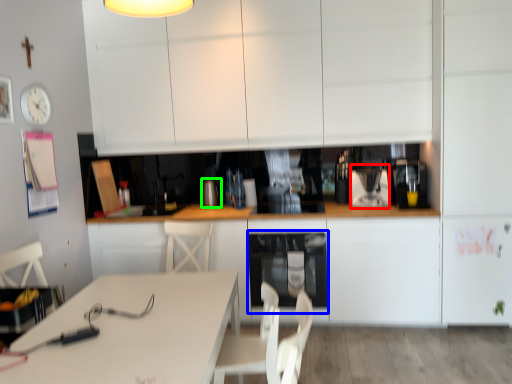
Question: Estimate the real-world distances between objects in this image. Which object is closer to appliance (highlighted by a red box), oven (highlighted by a blue box) or appliance (highlighted by a green box)?

Choices:
 (A) oven
 (B) appliance

Answer: (A)